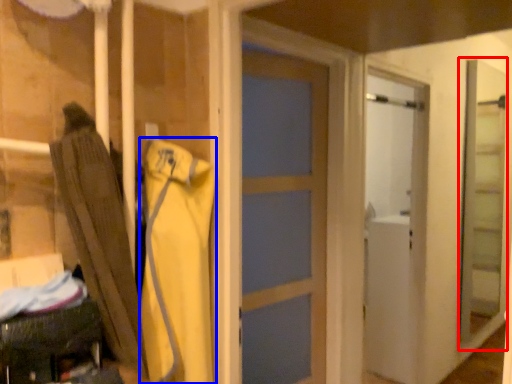
Question: Among these objects, which one is farthest to the camera, screen door (highlighted by a red box) or clothing (highlighted by a blue box)?

Choices:
 (A) screen door
 (B) clothing

Answer: (A)